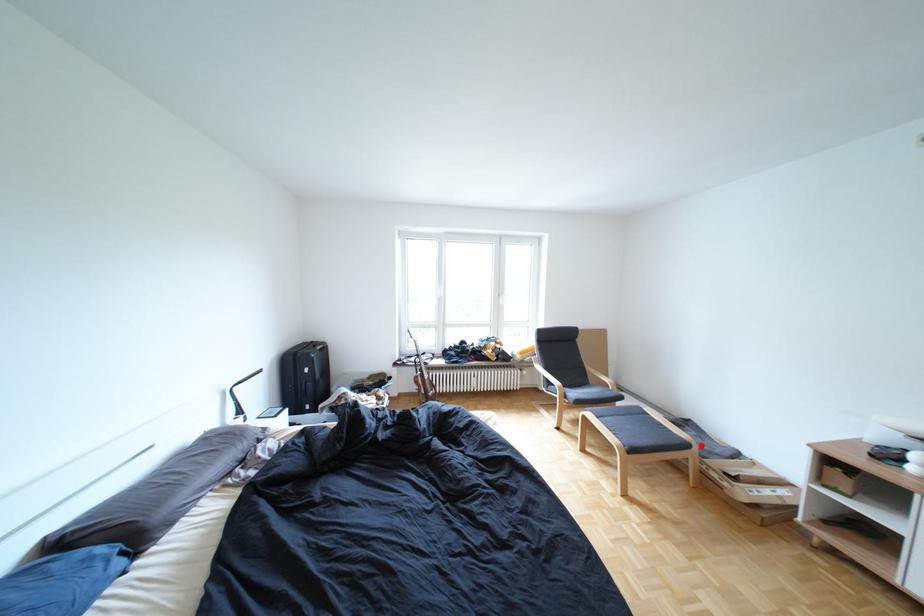
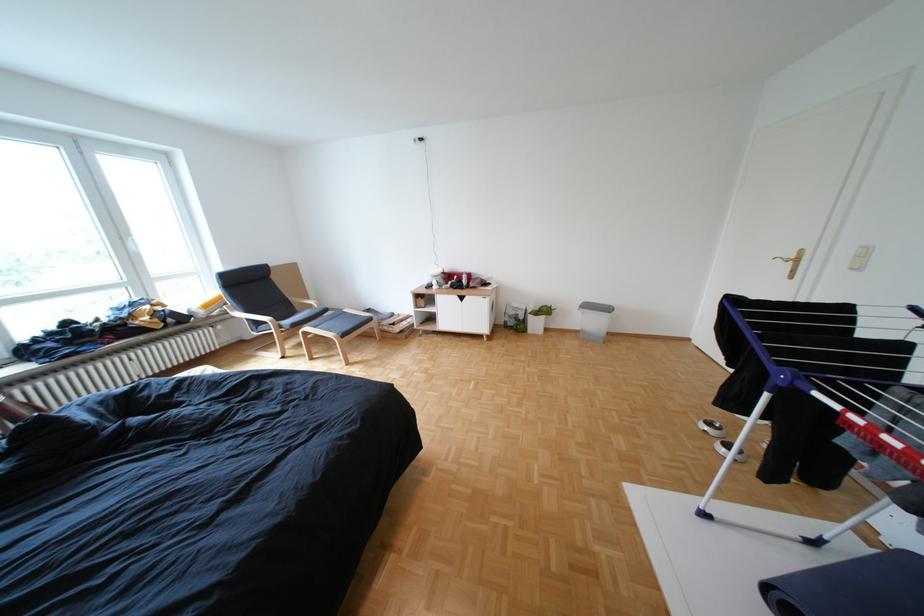
Question: A red point is marked in image1. In image2, is the corresponding 3D point closer to the camera or farther? Reply with the corresponding letter.

Choices:
 (A) The corresponding 3D point is closer.
 (B) The corresponding 3D point is farther.

Answer: (A)